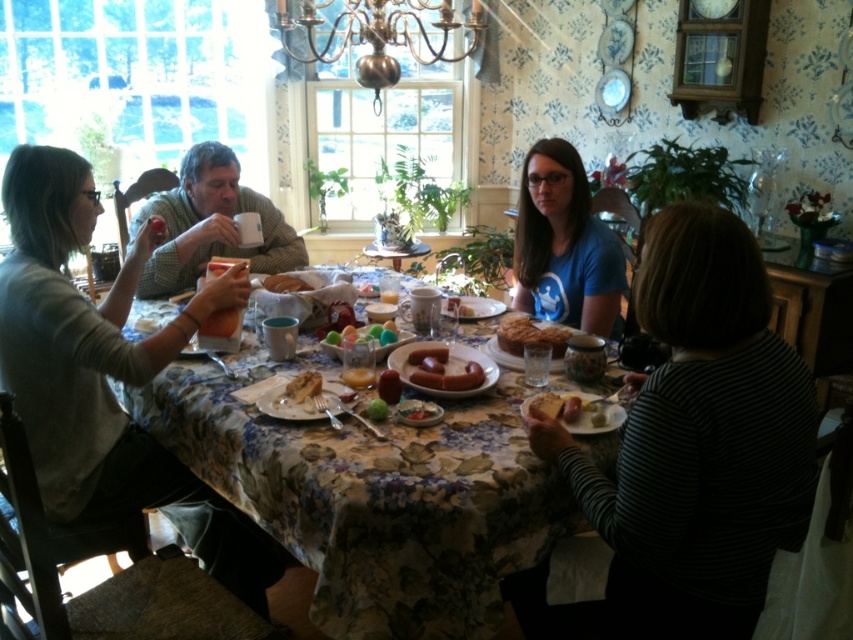
Question: Which point is farther to the camera?

Choices:
 (A) (672, 604)
 (B) (363, 326)

Answer: (B)

Question: Which of the following is the farthest from the observer?

Choices:
 (A) (374, 408)
 (B) (451, 308)
 (C) (350, 324)

Answer: (B)

Question: Is blue cotton shirt at center thinner than golden brown bread at lower center?

Choices:
 (A) no
 (B) yes

Answer: (A)

Question: Does matte plastic eggs at center appear over smooth white plate at center?

Choices:
 (A) yes
 (B) no

Answer: (A)

Question: Among these objects, which one is farthest from the camera?

Choices:
 (A) floral-patterned tablecloth at center
 (B) striped fabric shirt at lower right
 (C) metallic gold chandelier at upper center

Answer: (C)

Question: Does floral-patterned tablecloth at center have a smaller size compared to matte plastic eggs at center?

Choices:
 (A) yes
 (B) no

Answer: (B)